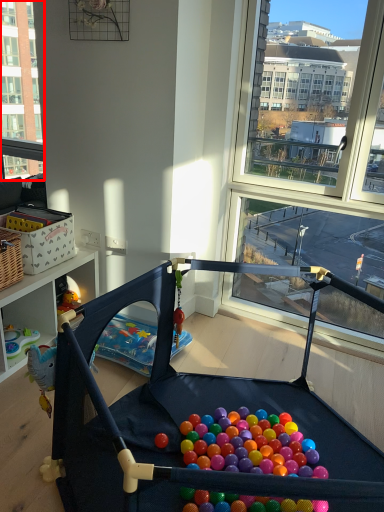
Question: From the image's perspective, where is window (annotated by the red box) located in relation to baby carriage in the image?

Choices:
 (A) above
 (B) below

Answer: (A)